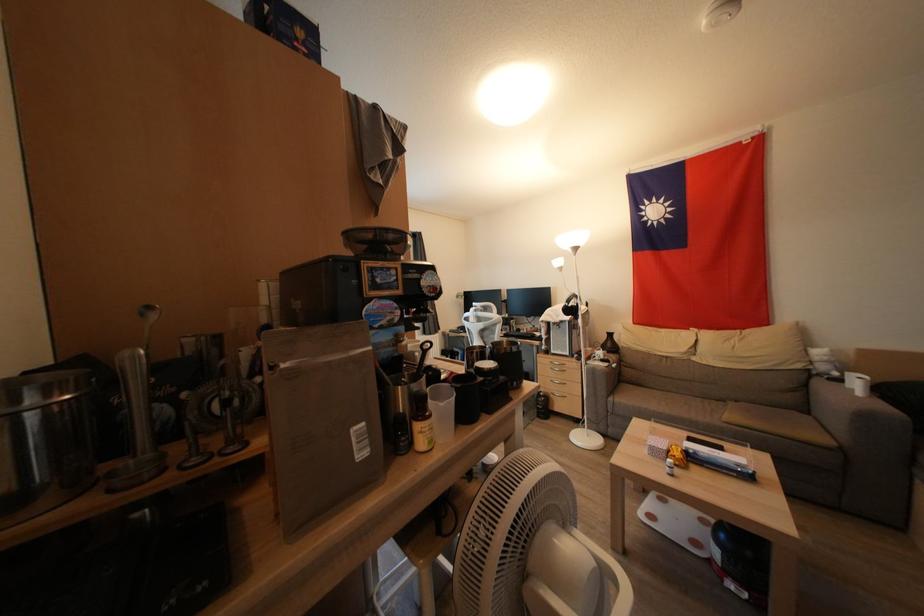
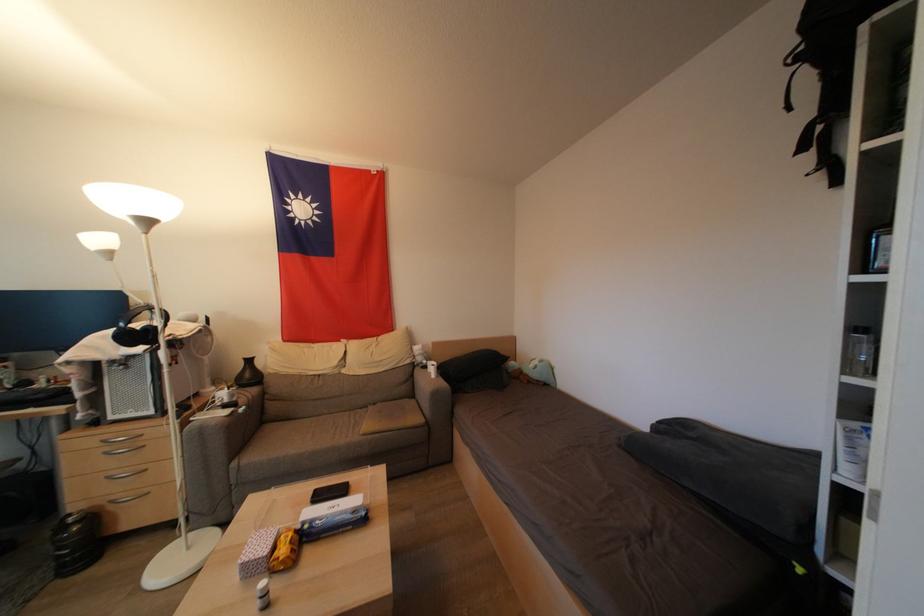
Locate, in the second image, the point that corresponds to the point at 736,408 in the first image.

(375, 411)